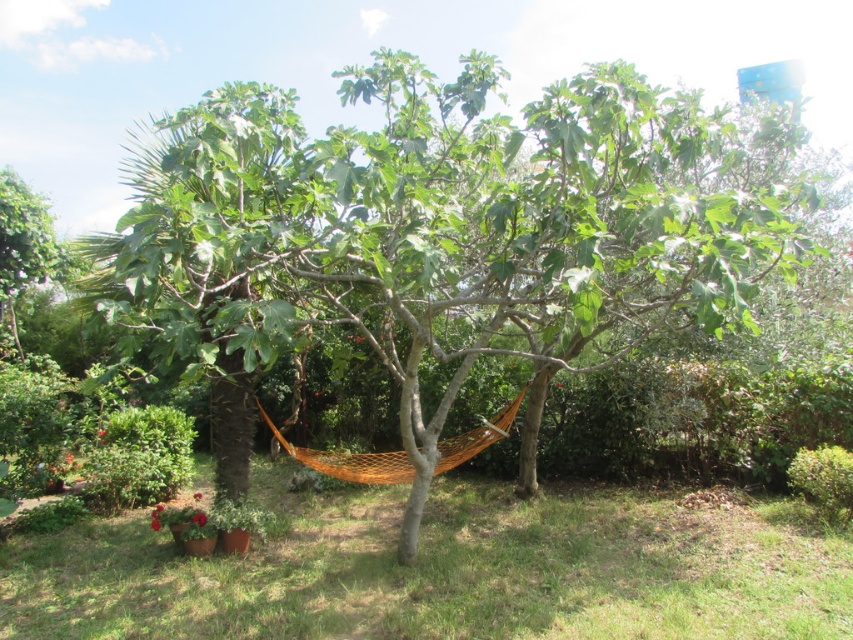
Question: Which point appears farthest from the camera in this image?

Choices:
 (A) (540, 211)
 (B) (364, 454)

Answer: (B)

Question: Can you confirm if green leafy tree at center is positioned to the right of orange mesh hammock at center?

Choices:
 (A) yes
 (B) no

Answer: (B)

Question: Can you confirm if green leafy tree at center is positioned above orange mesh hammock at center?

Choices:
 (A) no
 (B) yes

Answer: (B)

Question: Is green leafy tree at center wider than orange mesh hammock at center?

Choices:
 (A) yes
 (B) no

Answer: (A)

Question: Which point is closer to the camera?

Choices:
 (A) coord(189,298)
 (B) coord(457,465)

Answer: (A)